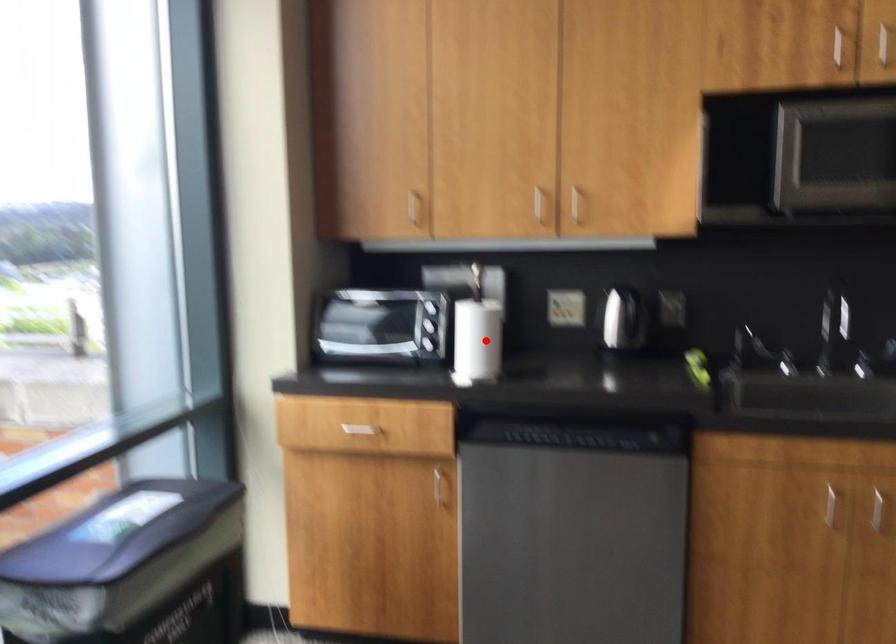
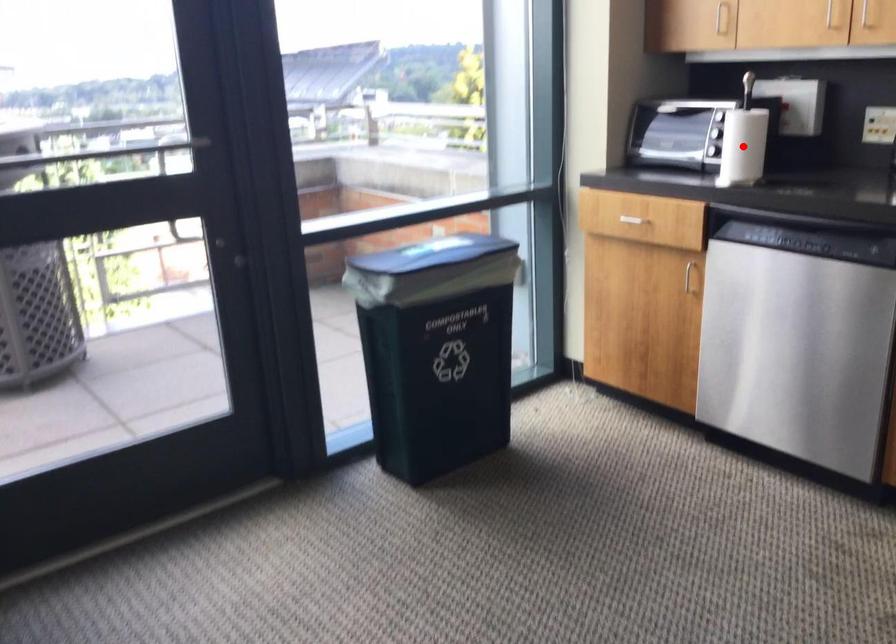
I am providing you with two images of the same scene from different viewpoints. A red point is marked on the first image and another point is marked on the second image. Are the points marked in image1 and image2 representing the same 3D position?

Yes